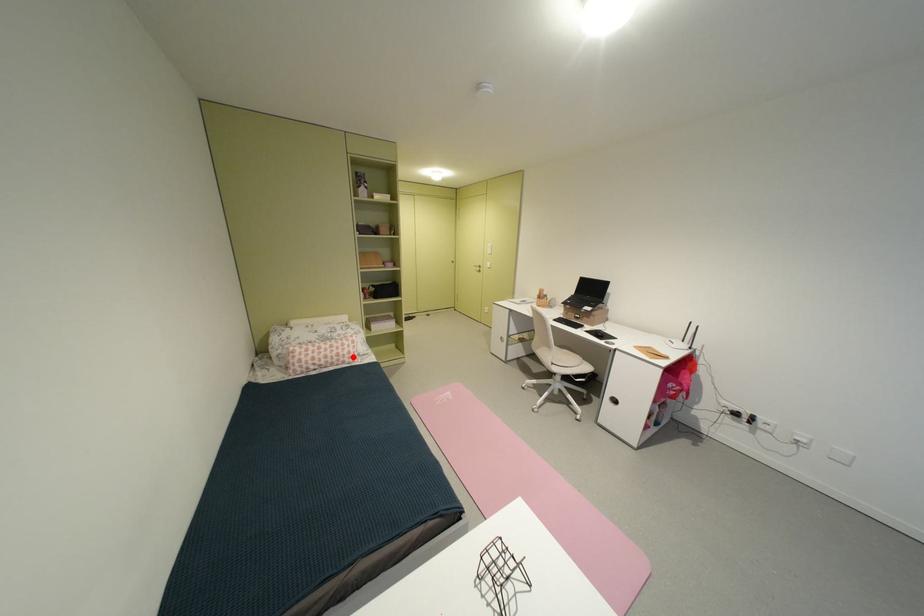
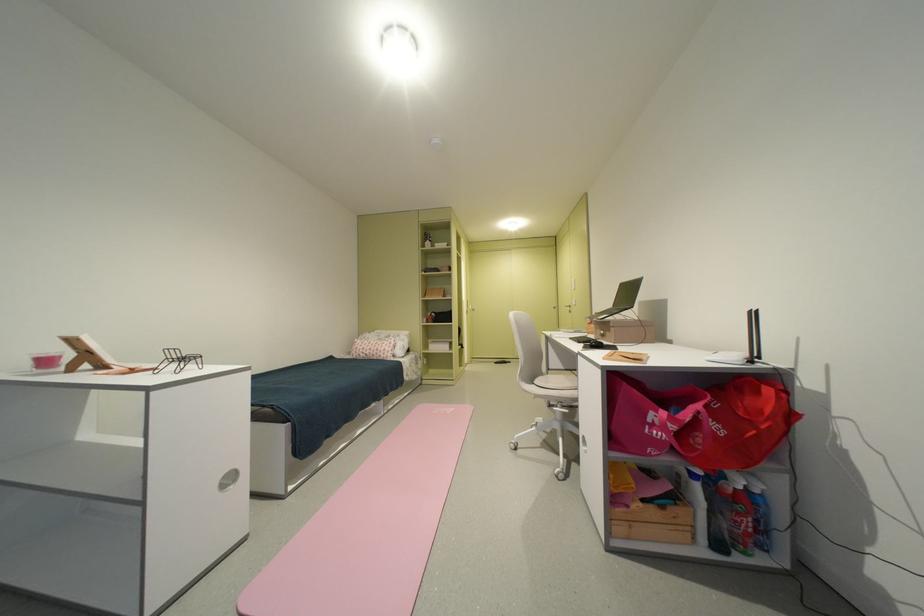
Question: I am providing you with two images of the same scene from different viewpoints. Image1 has a red point marked. In image2, the corresponding 3D location appears at what relative position? Reply with the corresponding letter.

Choices:
 (A) Closer
 (B) Farther

Answer: (B)